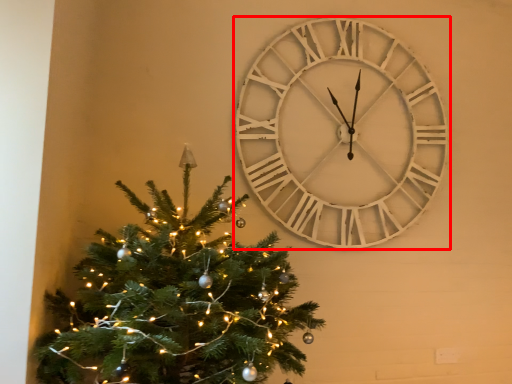
Question: From the image's perspective, considering the relative positions of wall clock (annotated by the red box) and christmas tree in the image provided, where is wall clock (annotated by the red box) located with respect to the staircase?

Choices:
 (A) below
 (B) above

Answer: (B)